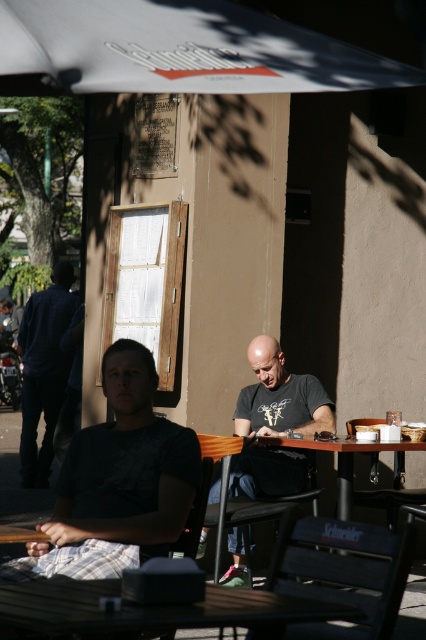
You are planning to set up a small event and need to decide which table can accommodate more guests. Based on the scene, which table between the wooden table at center and the wooden picnic table at center is wider?

The wooden table at center is wider than the wooden picnic table at center, so it can accommodate more guests.

You are a customer at this outdoor cafe and want to sit under the shade of the white fabric canopy at upper center. The wooden table at center is in your way. Can you walk around it to reach the canopy?

The wooden table at center is behind the white fabric canopy at upper center, so you can walk around the wooden table at center to reach the canopy.